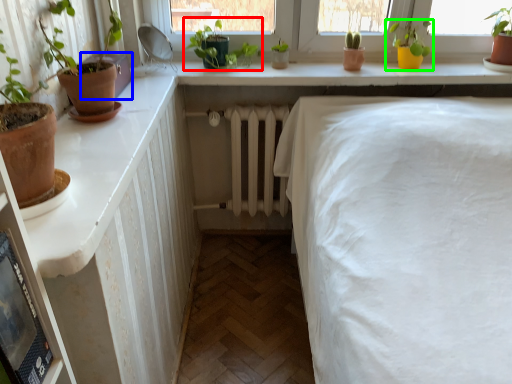
Question: Which object is the farthest from houseplant (highlighted by a red box)? Choose among these: window box (highlighted by a blue box) or houseplant (highlighted by a green box).

Choices:
 (A) window box
 (B) houseplant

Answer: (B)